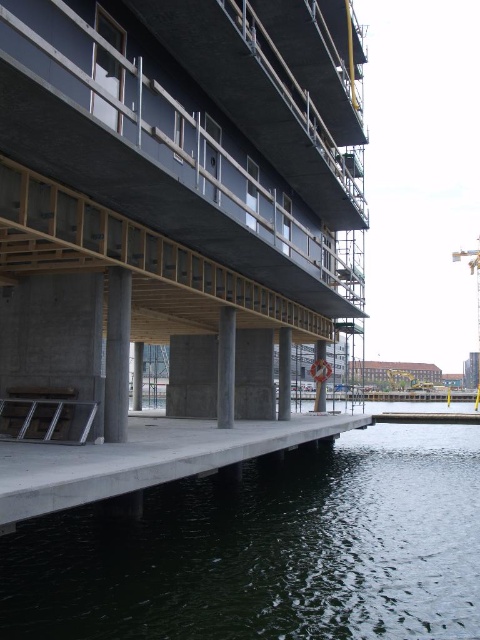
You are standing at the construction site and want to reach a specific point marked as point (126, 445). If your current position is 30 feet away from the building, can you safely walk towards the point without getting too close to the edge of the platform?

The distance of point (126, 445) from viewer is 41.96 feet. Since you are currently 30 feet away from the building, you need to move an additional 11.96 feet towards the building to reach the point. However, this may bring you closer to the edge of the platform, so ensure you stay within safe boundaries.

You are a construction worker standing at the center of the construction site. You need to place a heavy equipment at the coordinate point given in the description. Where should you place it relative to the concrete at lower left?

The concrete at lower left is located at point (144,458), so you should place the heavy equipment at that coordinate relative to the concrete at lower left.